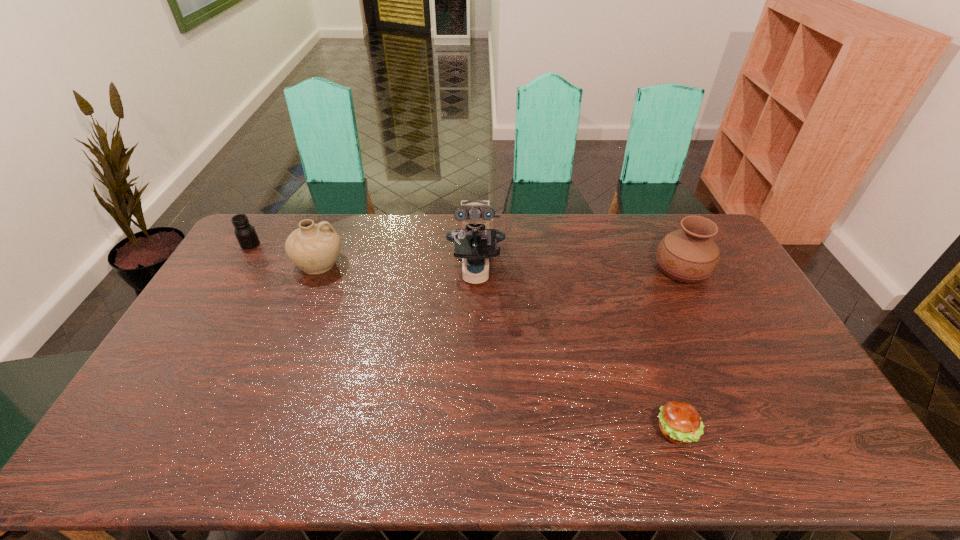
Find the location of `empty space between the rightmost object and the pottery`. empty space between the rightmost object and the pottery is located at coordinates (501, 266).

Locate an element on the screen. free space between the microscope and the rightmost object is located at coordinates (579, 269).

Where is `free space that is in between the tallest object and the leftmost object`? free space that is in between the tallest object and the leftmost object is located at coordinates (363, 258).

Locate an element on the screen. vacant region between the second object from left to right and the fourth tallest object is located at coordinates (285, 254).

This screenshot has width=960, height=540. In order to click on free area in between the second object from right to left and the pottery in this screenshot , I will do `click(497, 347)`.

Find the location of a particular element. This screenshot has width=960, height=540. vacant point located between the third object from right to left and the second object from left to right is located at coordinates (397, 267).

I want to click on empty space that is in between the pottery and the urn, so click(x=501, y=266).

I want to click on object that ranks as the closest to the jar, so click(x=314, y=248).

Identify which object is located as the third nearest to the shortest object. Please provide its 2D coordinates. Your answer should be formatted as a tuple, i.e. [(x, y)], where the tuple contains the x and y coordinates of a point satisfying the conditions above.

[(314, 248)]

Image resolution: width=960 pixels, height=540 pixels. What are the coordinates of `free location that satisfies the following two spatial constraints: 1. on the front side of the leftmost object; 2. on the left side of the nearest object` in the screenshot? It's located at pyautogui.click(x=137, y=430).